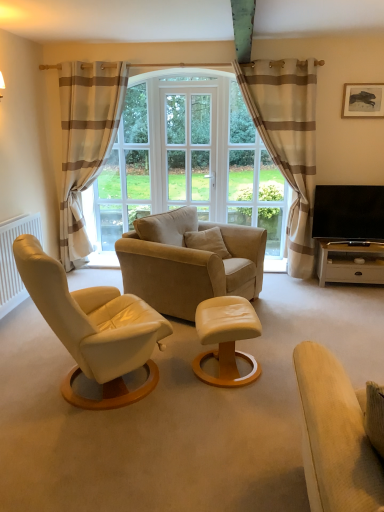
Question: From a real-world perspective, is white glass screen door at center physically located above or below white glossy table at right, which ranks as the first table in right-to-left order?

Choices:
 (A) below
 (B) above

Answer: (B)

Question: Is point (165, 123) closer or farther from the camera than point (342, 278)?

Choices:
 (A) farther
 (B) closer

Answer: (A)

Question: Which is nearer to the wooden framed picture at upper right?

Choices:
 (A) beige striped curtain at right, which is the first curtain in right-to-left order
 (B) white matte radiator at left
 (C) white glossy table at right, which is the first table from back to front
 (D) light beige fabric studio couch at lower right
 (E) matte leather ottoman at center, which is the second table in back-to-front order

Answer: (A)

Question: Which is nearer to the clear glass window at center?

Choices:
 (A) black glossy tv at right
 (B) white matte radiator at left
 (C) suede beige armchair at center
 (D) wooden framed picture at upper right
 (E) white glossy table at right, which is counted as the first table, starting from the top

Answer: (B)